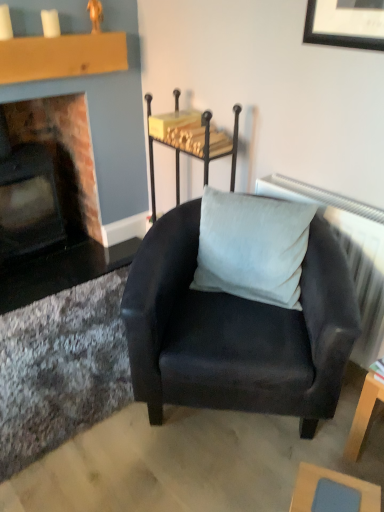
This screenshot has width=384, height=512. What do you see at coordinates (252, 247) in the screenshot? I see `suede-like gray pillow at center` at bounding box center [252, 247].

This screenshot has width=384, height=512. I want to click on suede-like gray pillow at center, so click(252, 247).

What do you see at coordinates (63, 150) in the screenshot?
I see `matte brick fireplace at left` at bounding box center [63, 150].

What do you see at coordinates (348, 252) in the screenshot? This screenshot has width=384, height=512. I see `gray fabric radiator at upper right` at bounding box center [348, 252].

Describe the element at coordinates (236, 331) in the screenshot. The width and height of the screenshot is (384, 512). I see `suede black armchair at center` at that location.

The image size is (384, 512). Find the location of `suede-like gray pillow at center`. suede-like gray pillow at center is located at coordinates (252, 247).

The image size is (384, 512). What are the coordinates of `chair below the suede-like gray pillow at center (from a real-world perspective)` in the screenshot? It's located at (236, 331).

Considering the sizes of objects suede black armchair at center and suede-like gray pillow at center in the image provided, who is wider, suede black armchair at center or suede-like gray pillow at center?

suede black armchair at center is wider.

From a real-world perspective, between suede black armchair at center and suede-like gray pillow at center, who is vertically lower?

From a 3D spatial view, suede black armchair at center is below.

Consider the image. Can you tell me how much gray fabric radiator at upper right and matte brick fireplace at left differ in facing direction?

The angular difference between gray fabric radiator at upper right and matte brick fireplace at left is 88.9 degrees.

Considering the points (317, 193) and (56, 109), which point is in front, point (317, 193) or point (56, 109)?

The point (317, 193) is in front.

From a real-world perspective, is gray fabric radiator at upper right located beneath matte brick fireplace at left?

Yes, from a real-world perspective, gray fabric radiator at upper right is below matte brick fireplace at left.

From a real-world perspective, which object stands above the other?

From a 3D spatial view, matte brick fireplace at left is above.

Considering the relative sizes of suede black armchair at center and matte brick fireplace at left in the image provided, is suede black armchair at center thinner than matte brick fireplace at left?

Incorrect, the width of suede black armchair at center is not less than that of matte brick fireplace at left.

Based on the photo, can you tell me how much suede black armchair at center and matte brick fireplace at left differ in facing direction?

They differ by 46.5 degrees in their facing directions.

Does metallic black table at upper center, the first table when ordered from left to right, have a smaller size compared to light blue fabric table at lower right, the 3th table when ordered from back to front?

Incorrect, metallic black table at upper center, the first table when ordered from left to right, is not smaller in size than light blue fabric table at lower right, the 3th table when ordered from back to front.

Which is in front, metallic black table at upper center, the first table when ordered from left to right, or light blue fabric table at lower right, the 1th table in the front-to-back sequence?

light blue fabric table at lower right, the 1th table in the front-to-back sequence, is closer to the camera.

From a real-world perspective, who is located lower, metallic black table at upper center, which is the 1th table in back-to-front order, or light blue fabric table at lower right, the 1th table in the front-to-back sequence?

light blue fabric table at lower right, the 1th table in the front-to-back sequence, from a real-world perspective.

Find the location of a particular element. This screenshot has height=512, width=384. radiator behind the wooden table at lower right, which is counted as the 2th table, starting from the front is located at coordinates (348, 252).

Would you say wooden table at lower right, the 2th table from the back, is to the left or to the right of gray fabric radiator at upper right in the picture?

wooden table at lower right, the 2th table from the back, is to the right of gray fabric radiator at upper right.

Who is more distant, wooden table at lower right, which is counted as the 2th table, starting from the front, or gray fabric radiator at upper right?

gray fabric radiator at upper right.

From the image's perspective, between wooden table at lower right, the 2th table from the back, and gray fabric radiator at upper right, who is located below?

wooden table at lower right, the 2th table from the back.

Can you see suede-like gray pillow at center touching matte brick fireplace at left?

There is a gap between suede-like gray pillow at center and matte brick fireplace at left.

Is suede-like gray pillow at center inside or outside of matte brick fireplace at left?

suede-like gray pillow at center is located beyond the bounds of matte brick fireplace at left.

Looking at this image, who is more distant, suede-like gray pillow at center or matte brick fireplace at left?

matte brick fireplace at left is further from the camera.

Considering the relative sizes of suede-like gray pillow at center and matte brick fireplace at left in the image provided, is suede-like gray pillow at center shorter than matte brick fireplace at left?

Yes.

From a real-world perspective, relative to metallic black table at upper center, the third table in the front-to-back sequence, is matte brick fireplace at left vertically above or below?

From a real-world perspective, matte brick fireplace at left is physically below metallic black table at upper center, the third table in the front-to-back sequence.

From the image's perspective, which object appears higher, matte brick fireplace at left or metallic black table at upper center, placed as the 3th table when sorted from bottom to top?

matte brick fireplace at left, from the image's perspective.

Considering the sizes of matte brick fireplace at left and metallic black table at upper center, the third table in the front-to-back sequence, in the image, is matte brick fireplace at left taller or shorter than metallic black table at upper center, the third table in the front-to-back sequence,?

Considering their sizes, matte brick fireplace at left has more height than metallic black table at upper center, the third table in the front-to-back sequence.

How many degrees apart are the facing directions of matte brick fireplace at left and metallic black table at upper center, the third table in the front-to-back sequence?

They differ by 91 degrees in their facing directions.

Where is `pillow behind the suede black armchair at center`? The height and width of the screenshot is (512, 384). pillow behind the suede black armchair at center is located at coordinates (252, 247).

I want to click on radiator that is under the matte brick fireplace at left (from a real-world perspective), so click(x=348, y=252).

Considering their positions, is suede-like gray pillow at center positioned further to light blue fabric table at lower right, placed as the 3th table when sorted from top to bottom, than wooden table at lower right, which appears as the second table when ordered from the bottom?

suede-like gray pillow at center is positioned further to the anchor light blue fabric table at lower right, placed as the 3th table when sorted from top to bottom.

Based on their spatial positions, is light blue fabric table at lower right, the 3th table when ordered from back to front, or metallic black table at upper center, which is the 1th table in back-to-front order, further from matte brick fireplace at left?

light blue fabric table at lower right, the 3th table when ordered from back to front, lies further to matte brick fireplace at left than the other object.

From the image, which object appears to be nearer to suede black armchair at center, wooden table at lower right, which appears as the second table when ordered from the bottom, or light blue fabric table at lower right, which appears as the 1th table when ordered from the bottom?

wooden table at lower right, which appears as the second table when ordered from the bottom.

Estimate the real-world distances between objects in this image. Which object is closer to wooden table at lower right, which is counted as the 2th table, starting from the front, gray fabric radiator at upper right or suede black armchair at center?

gray fabric radiator at upper right is closer to wooden table at lower right, which is counted as the 2th table, starting from the front.

Which object lies further to the anchor point gray fabric radiator at upper right, light blue fabric table at lower right, placed as the 3th table when sorted from top to bottom, or suede black armchair at center?

light blue fabric table at lower right, placed as the 3th table when sorted from top to bottom.

When comparing their distances from matte brick fireplace at left, does suede-like gray pillow at center or light blue fabric table at lower right, the 1th table in the front-to-back sequence, seem further?

Among the two, light blue fabric table at lower right, the 1th table in the front-to-back sequence, is located further to matte brick fireplace at left.

From the image, which object appears to be nearer to wooden table at lower right, which ranks as the second table in top-to-bottom order, metallic black table at upper center, which is the 1th table in back-to-front order, or suede black armchair at center?

The object closer to wooden table at lower right, which ranks as the second table in top-to-bottom order, is suede black armchair at center.

When comparing their distances from light blue fabric table at lower right, which appears as the second table when viewed from the left, does metallic black table at upper center, which is the 1th table from top to bottom, or suede black armchair at center seem closer?

The object closer to light blue fabric table at lower right, which appears as the second table when viewed from the left, is suede black armchair at center.

I want to click on radiator between metallic black table at upper center, the first table when ordered from left to right, and light blue fabric table at lower right, the second table viewed from the right, from top to bottom, so click(348, 252).

In order to click on pillow between matte brick fireplace at left and wooden table at lower right, which ranks as the second table in top-to-bottom order, from left to right in this screenshot , I will do `click(252, 247)`.

At what (x,y) coordinates should I click in order to perform the action: click on pillow between matte brick fireplace at left and gray fabric radiator at upper right. Please return your answer as a coordinate pair (x, y). Looking at the image, I should click on (252, 247).

Where is `table situated between matte brick fireplace at left and suede black armchair at center from left to right`? The height and width of the screenshot is (512, 384). table situated between matte brick fireplace at left and suede black armchair at center from left to right is located at coordinates (190, 141).